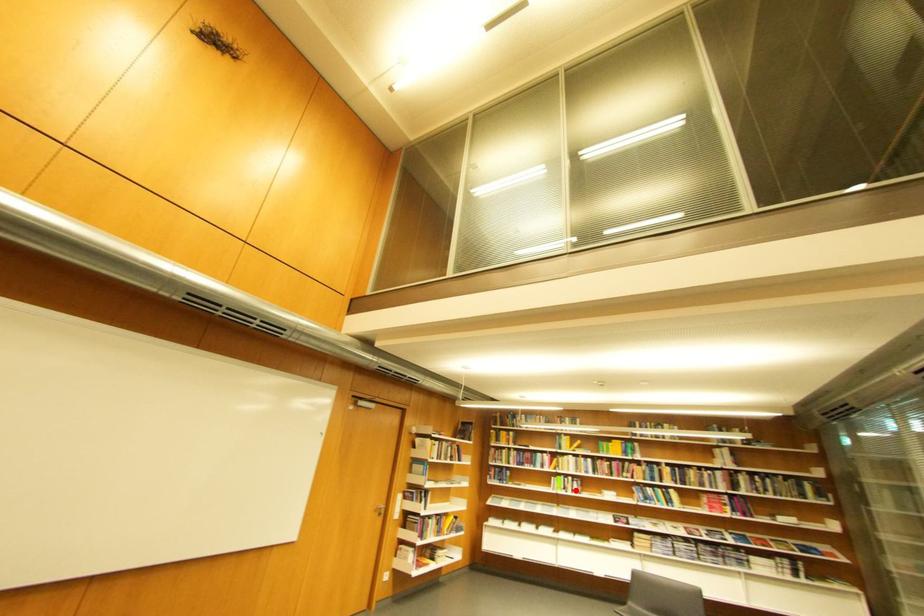
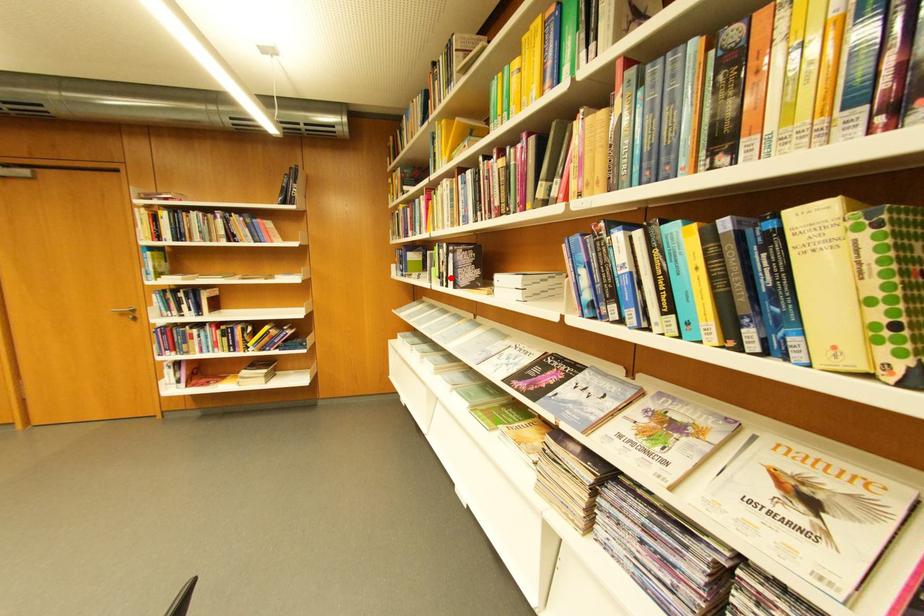
I am providing you with two images of the same scene from different viewpoints. A red point is marked on the first image and another point is marked on the second image. Is the marked point in image1 the same physical position as the marked point in image2?

Yes